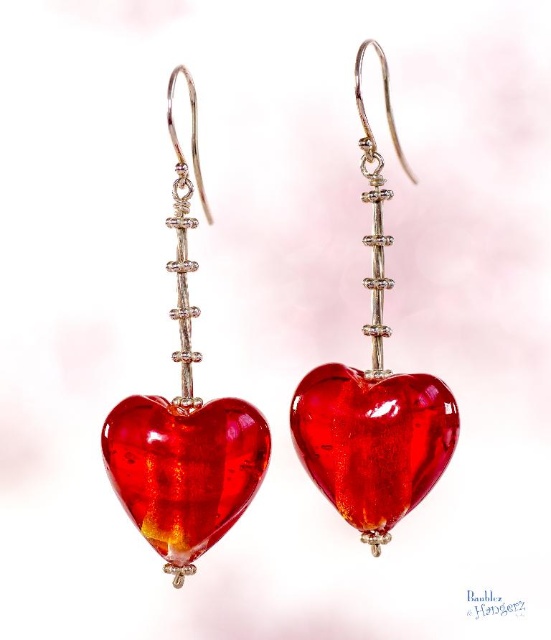
Question: Can you confirm if shiny glass heart at center is positioned above matte glass heart at center?

Choices:
 (A) yes
 (B) no

Answer: (A)

Question: Is shiny glass heart at center below translucent amber heart at center?

Choices:
 (A) yes
 (B) no

Answer: (B)

Question: Which object appears closest to the camera in this image?

Choices:
 (A) matte glass heart at center
 (B) glossy red heart at center
 (C) translucent amber heart at center

Answer: (A)

Question: Which object is the farthest from the glossy red heart at center?

Choices:
 (A) shiny glass heart at center
 (B) matte glass heart at center

Answer: (B)

Question: Is matte glass heart at center to the right of glossy red heart at center from the viewer's perspective?

Choices:
 (A) no
 (B) yes

Answer: (A)

Question: Which of the following is the closest to the observer?

Choices:
 (A) (435, 396)
 (B) (380, 326)
 (C) (176, 426)
 (D) (204, 436)

Answer: (D)